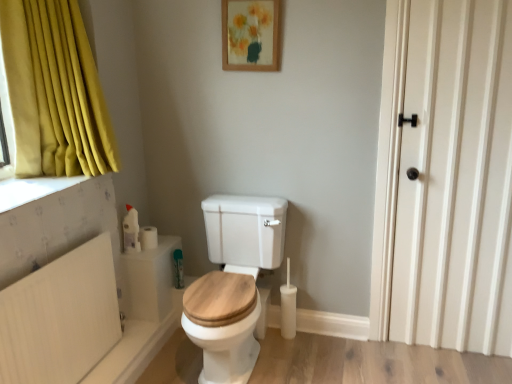
Question: Could you tell me if white plastic radiator at lower left is turned towards wooden toilet seat at center?

Choices:
 (A) no
 (B) yes

Answer: (B)

Question: Considering the relative positions of white plastic radiator at lower left and wooden toilet seat at center in the image provided, is white plastic radiator at lower left to the right of wooden toilet seat at center from the viewer's perspective?

Choices:
 (A) yes
 (B) no

Answer: (B)

Question: From the image's perspective, would you say white plastic radiator at lower left is shown under wooden toilet seat at center?

Choices:
 (A) no
 (B) yes

Answer: (B)

Question: Is white plastic radiator at lower left positioned beyond the bounds of wooden toilet seat at center?

Choices:
 (A) yes
 (B) no

Answer: (A)

Question: From a real-world perspective, is white plastic radiator at lower left positioned under wooden toilet seat at center based on gravity?

Choices:
 (A) no
 (B) yes

Answer: (A)

Question: In the image, is wooden picture frame at upper center positioned in front of or behind white matte door at right?

Choices:
 (A) front
 (B) behind

Answer: (B)

Question: From their relative heights in the image, would you say wooden picture frame at upper center is taller or shorter than white matte door at right?

Choices:
 (A) short
 (B) tall

Answer: (A)

Question: Visually, is wooden picture frame at upper center positioned to the left or to the right of white matte door at right?

Choices:
 (A) left
 (B) right

Answer: (A)

Question: In terms of width, does wooden picture frame at upper center look wider or thinner when compared to white matte door at right?

Choices:
 (A) wide
 (B) thin

Answer: (B)

Question: Is wooden picture frame at upper center inside or outside of white matte toilet paper at lower left, marked as the 2th toilet paper in a back-to-front arrangement?

Choices:
 (A) outside
 (B) inside

Answer: (A)

Question: Does point (267, 4) appear closer or farther from the camera than point (147, 246)?

Choices:
 (A) farther
 (B) closer

Answer: (B)

Question: Is wooden picture frame at upper center to the left or to the right of white matte toilet paper at lower left, positioned as the first toilet paper in front-to-back order, in the image?

Choices:
 (A) right
 (B) left

Answer: (A)

Question: Is wooden picture frame at upper center in front of or behind white matte toilet paper at lower left, marked as the 2th toilet paper in a back-to-front arrangement, in the image?

Choices:
 (A) behind
 (B) front

Answer: (B)

Question: From a real-world perspective, is wooden toilet seat at center above or below white plastic radiator at lower left?

Choices:
 (A) above
 (B) below

Answer: (B)

Question: Is wooden toilet seat at center taller or shorter than white plastic radiator at lower left?

Choices:
 (A) short
 (B) tall

Answer: (B)